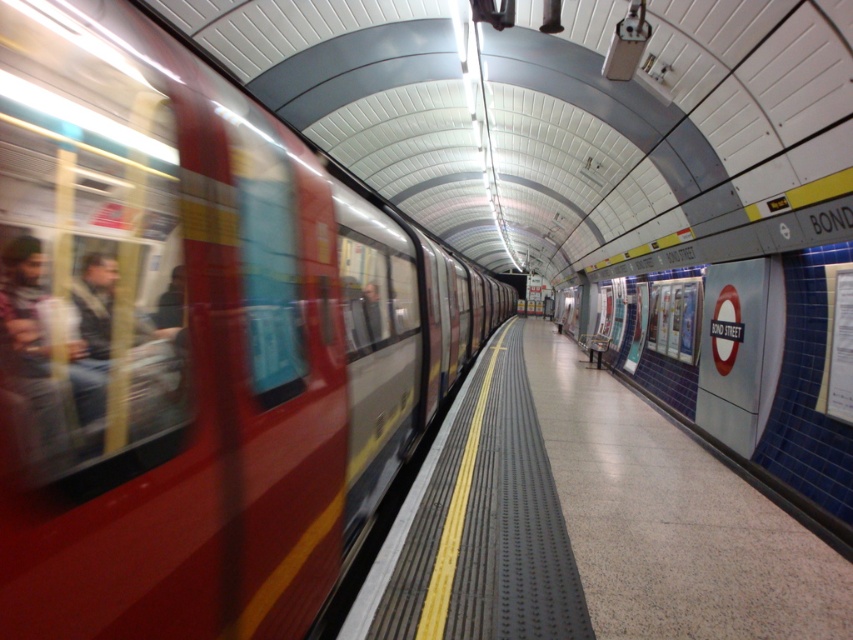
You are waiting on the platform at Bond Street station. You see the metallic red train at left and the polished concrete platform at center. Which object is nearer to you?

The metallic red train at left is closer to the viewer than the polished concrete platform at center.

Based on the photo, you are standing at the platform of Bond Street station. There are two points marked on the platform. The first point is at coordinate point(227, 376) and the second is at point(688, 528). If you want to walk from the first point to the second point, which direction should you move? Consider the platform layout and the train position.

Since point(227, 376) is in front of point(688, 528), you should move backward to reach the second point from the first point.

You are standing at Bond Street station on the platform. You see a point marked at coordinates (193, 342). What object does this point correspond to?

The point at coordinates (193, 342) corresponds to the metallic red train at left.